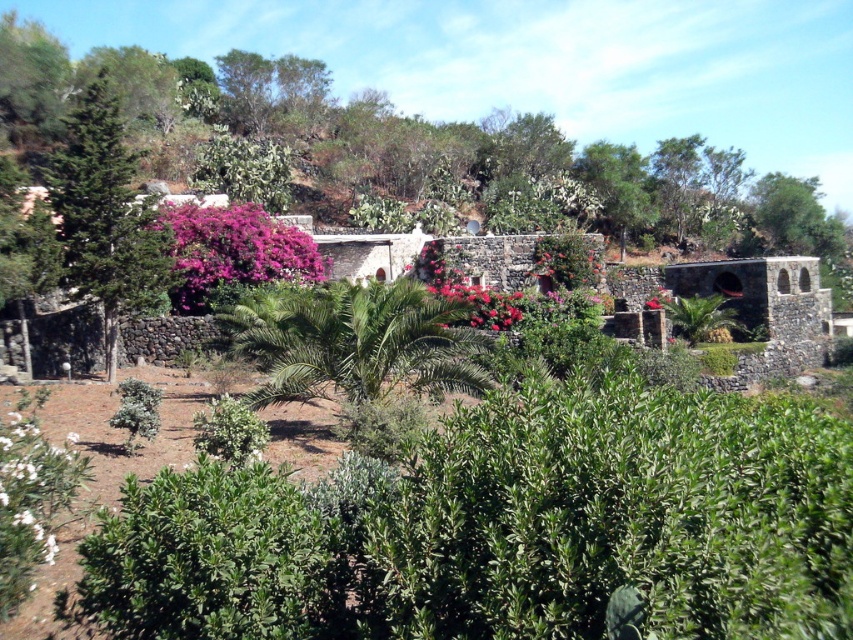
You are designing a garden layout and need to place a 1.2 meter wide statue between the purple matte flowers at left and the green leafy bush at lower left. Based on their widths, will the statue fit between them?

The purple matte flowers at left are wider than the green leafy bush at lower left. Since the statue is 1.2 meters wide, the total width available between them must be at least 1.2 meters. However, without knowing the exact distance between the two objects, we cannot confirm if the statue will fit. The question only provides information about their individual widths, not the space between them.

You are standing in the garden and want to take a photo of the purple matte flowers at left without the green textured tree at left blocking the view. Is this possible?

The green textured tree at left is in front of the purple matte flowers at left, so you cannot take a photo of the purple matte flowers at left without the green textured tree at left blocking the view.

You are standing in the garden and want to take a photo of the green textured tree at left and the purple matte flowers at left. Which one is more to the left?

The green textured tree at left is more to the left.